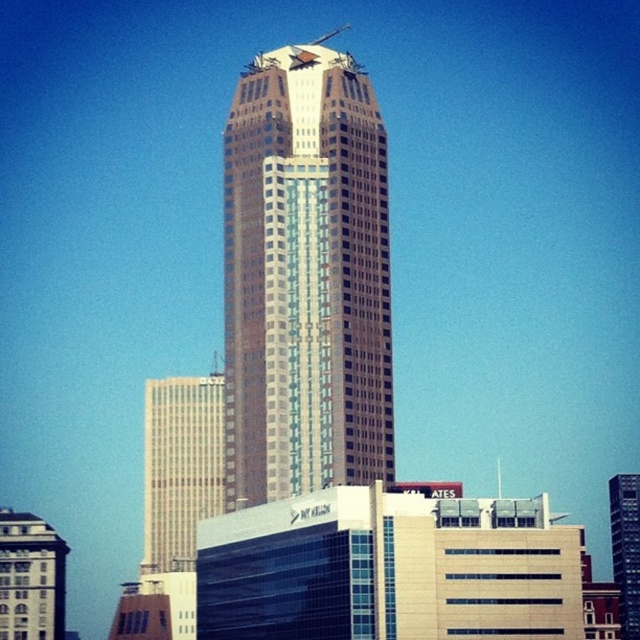
Can you confirm if beige glass building at left is wider than glassy reflective skyscraper at center?

No, beige glass building at left is not wider than glassy reflective skyscraper at center.

What do you see at coordinates (180, 467) in the screenshot? The image size is (640, 640). I see `beige glass building at left` at bounding box center [180, 467].

Identify the location of beige glass building at left. (180, 467).

Looking at this image, does white marble building at lower left have a lesser height compared to glassy reflective skyscraper at center?

Yes, white marble building at lower left is shorter than glassy reflective skyscraper at center.

Describe the element at coordinates (29, 577) in the screenshot. This screenshot has height=640, width=640. I see `white marble building at lower left` at that location.

Does point (44, 636) come behind point (620, 557)?

No.

I want to click on white marble building at lower left, so click(29, 577).

Does beige glass building at left lie in front of white marble building at lower left?

No, it is not.

Is beige glass building at left to the right of white marble building at lower left from the viewer's perspective?

Correct, you'll find beige glass building at left to the right of white marble building at lower left.

The width and height of the screenshot is (640, 640). What are the coordinates of `beige glass building at left` in the screenshot? It's located at pyautogui.click(x=180, y=467).

This screenshot has width=640, height=640. In order to click on beige glass building at left in this screenshot , I will do `click(180, 467)`.